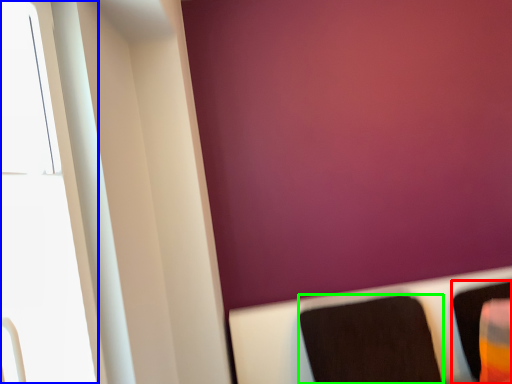
Question: Which is nearer to the furniture (highlighted by a red box)? window (highlighted by a blue box) or furniture (highlighted by a green box).

Choices:
 (A) window
 (B) furniture

Answer: (B)